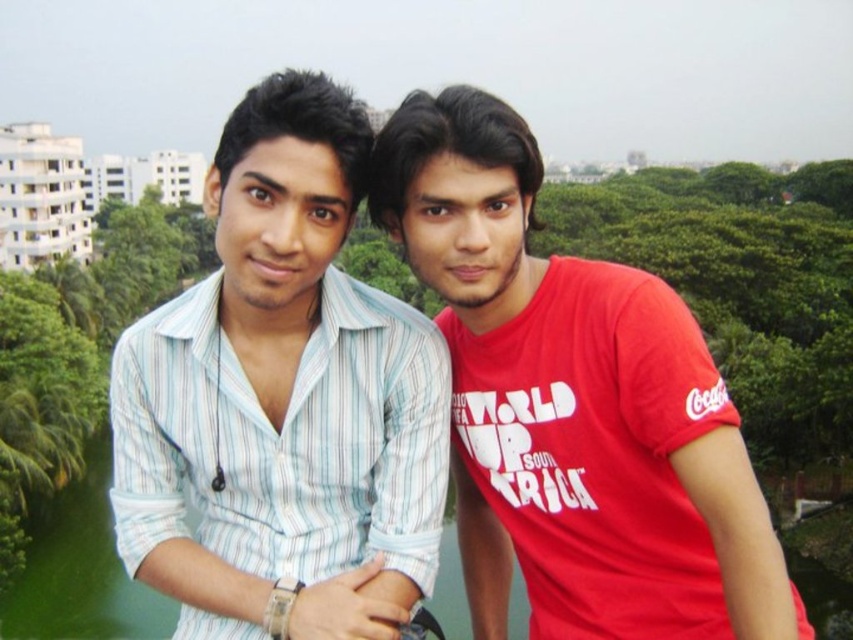
Question: Which point is farther to the camera?

Choices:
 (A) (643, 547)
 (B) (296, 616)

Answer: (A)

Question: Which of the following is the closest to the observer?

Choices:
 (A) light blue striped shirt at center
 (B) matte red t-shirt at right

Answer: (B)

Question: Observing the image, what is the correct spatial positioning of light blue striped shirt at center in reference to matte red t-shirt at right?

Choices:
 (A) above
 (B) below

Answer: (B)

Question: Is light blue striped shirt at center below matte red t-shirt at right?

Choices:
 (A) yes
 (B) no

Answer: (A)

Question: Is light blue striped shirt at center wider than matte red t-shirt at right?

Choices:
 (A) no
 (B) yes

Answer: (B)